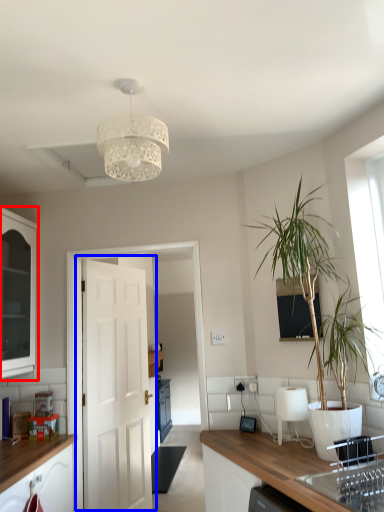
Question: Which of the following is the farthest to the observer, cabinetry (highlighted by a red box) or door (highlighted by a blue box)?

Choices:
 (A) cabinetry
 (B) door

Answer: (B)